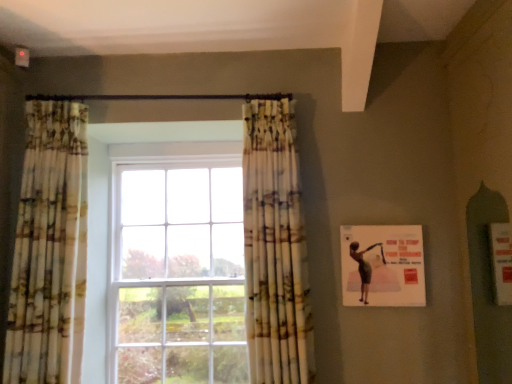
Where is `printed fabric curtain at center, the second curtain in the left-to-right sequence`? Image resolution: width=512 pixels, height=384 pixels. printed fabric curtain at center, the second curtain in the left-to-right sequence is located at coordinates (275, 248).

The width and height of the screenshot is (512, 384). What do you see at coordinates (50, 249) in the screenshot?
I see `printed fabric curtain at left, the 1th curtain positioned from the left` at bounding box center [50, 249].

Identify the location of printed fabric curtain at center, the second curtain in the left-to-right sequence. (275, 248).

Is printed fabric curtain at left, positioned as the second curtain in right-to-left order, situated inside matte pink poster at right or outside?

printed fabric curtain at left, positioned as the second curtain in right-to-left order, exists outside the volume of matte pink poster at right.

Can you confirm if printed fabric curtain at left, positioned as the second curtain in right-to-left order, is smaller than matte pink poster at right?

Actually, printed fabric curtain at left, positioned as the second curtain in right-to-left order, might be larger than matte pink poster at right.

Looking at this image, which object is positioned more to the left, printed fabric curtain at left, the 1th curtain positioned from the left, or matte pink poster at right?

Positioned to the left is printed fabric curtain at left, the 1th curtain positioned from the left.

Is the depth of printed fabric curtain at left, positioned as the second curtain in right-to-left order, less than that of matte pink poster at right?

Yes, printed fabric curtain at left, positioned as the second curtain in right-to-left order, is closer to the viewer.

From the image's perspective, which one is positioned higher, printed fabric curtain at center, which is the 1th curtain in right-to-left order, or printed fabric curtain at left, the 1th curtain positioned from the left?

printed fabric curtain at left, the 1th curtain positioned from the left, from the image's perspective.

Is printed fabric curtain at center, which is the 1th curtain in right-to-left order, beside printed fabric curtain at left, the 1th curtain positioned from the left?

No, printed fabric curtain at center, which is the 1th curtain in right-to-left order, is not with printed fabric curtain at left, the 1th curtain positioned from the left.

Is printed fabric curtain at center, which is the 1th curtain in right-to-left order, facing away from printed fabric curtain at left, the 1th curtain positioned from the left?

No, printed fabric curtain at left, the 1th curtain positioned from the left, is not at the back of printed fabric curtain at center, which is the 1th curtain in right-to-left order.

Can you confirm if printed fabric curtain at center, the second curtain in the left-to-right sequence, is bigger than printed fabric curtain at left, the 1th curtain positioned from the left?

Actually, printed fabric curtain at center, the second curtain in the left-to-right sequence, might be smaller than printed fabric curtain at left, the 1th curtain positioned from the left.

In terms of height, does matte pink poster at right look taller or shorter compared to printed fabric curtain at center, which is the 1th curtain in right-to-left order?

Considering their sizes, matte pink poster at right has less height than printed fabric curtain at center, which is the 1th curtain in right-to-left order.

From the image's perspective, is matte pink poster at right above printed fabric curtain at center, the second curtain in the left-to-right sequence?

Actually, matte pink poster at right appears below printed fabric curtain at center, the second curtain in the left-to-right sequence, in the image.

From a real-world perspective, who is located lower, matte pink poster at right or printed fabric curtain at center, which is the 1th curtain in right-to-left order?

matte pink poster at right, from a real-world perspective.

Could you measure the distance between matte pink poster at right and printed fabric curtain at left, the 1th curtain positioned from the left?

The distance of matte pink poster at right from printed fabric curtain at left, the 1th curtain positioned from the left, is 1.52 meters.

From a real-world perspective, is matte pink poster at right above or below printed fabric curtain at left, the 1th curtain positioned from the left?

In terms of real-world spatial position, matte pink poster at right is below printed fabric curtain at left, the 1th curtain positioned from the left.

Is matte pink poster at right taller or shorter than printed fabric curtain at left, the 1th curtain positioned from the left?

Clearly, matte pink poster at right is shorter compared to printed fabric curtain at left, the 1th curtain positioned from the left.

Looking at this image, which object is further away from the camera, printed fabric curtain at center, which is the 1th curtain in right-to-left order, or matte pink poster at right?

matte pink poster at right is further from the camera.

Is printed fabric curtain at center, the second curtain in the left-to-right sequence, taller or shorter than matte pink poster at right?

printed fabric curtain at center, the second curtain in the left-to-right sequence, is taller than matte pink poster at right.

How much distance is there between printed fabric curtain at center, which is the 1th curtain in right-to-left order, and matte pink poster at right?

printed fabric curtain at center, which is the 1th curtain in right-to-left order, is 16.39 inches away from matte pink poster at right.

Considering the relative sizes of printed fabric curtain at center, which is the 1th curtain in right-to-left order, and matte pink poster at right in the image provided, is printed fabric curtain at center, which is the 1th curtain in right-to-left order, wider than matte pink poster at right?

Yes, printed fabric curtain at center, which is the 1th curtain in right-to-left order, is wider than matte pink poster at right.

Is printed fabric curtain at center, the second curtain in the left-to-right sequence, at the back of printed fabric curtain at left, positioned as the second curtain in right-to-left order?

No, printed fabric curtain at center, the second curtain in the left-to-right sequence, is not at the back of printed fabric curtain at left, positioned as the second curtain in right-to-left order.

Is the surface of printed fabric curtain at left, positioned as the second curtain in right-to-left order, in direct contact with printed fabric curtain at center, the second curtain in the left-to-right sequence?

No, printed fabric curtain at left, positioned as the second curtain in right-to-left order, is not making contact with printed fabric curtain at center, the second curtain in the left-to-right sequence.

Is printed fabric curtain at left, positioned as the second curtain in right-to-left order, to the left or to the right of printed fabric curtain at center, which is the 1th curtain in right-to-left order, in the image?

printed fabric curtain at left, positioned as the second curtain in right-to-left order, is to the left of printed fabric curtain at center, which is the 1th curtain in right-to-left order.

From the image's perspective, is printed fabric curtain at left, the 1th curtain positioned from the left, positioned above or below printed fabric curtain at center, the second curtain in the left-to-right sequence?

Based on their image positions, printed fabric curtain at left, the 1th curtain positioned from the left, is located above printed fabric curtain at center, the second curtain in the left-to-right sequence.

The image size is (512, 384). I want to click on poster below the printed fabric curtain at left, positioned as the second curtain in right-to-left order (from the image's perspective), so click(x=383, y=265).

The image size is (512, 384). I want to click on curtain in front of the printed fabric curtain at left, the 1th curtain positioned from the left, so click(275, 248).

Looking at the image, which one is located further to printed fabric curtain at left, positioned as the second curtain in right-to-left order, printed fabric curtain at center, the second curtain in the left-to-right sequence, or matte pink poster at right?

The object further to printed fabric curtain at left, positioned as the second curtain in right-to-left order, is matte pink poster at right.

Looking at this image, based on their spatial positions, is matte pink poster at right or printed fabric curtain at center, which is the 1th curtain in right-to-left order, further from printed fabric curtain at left, the 1th curtain positioned from the left?

matte pink poster at right is further to printed fabric curtain at left, the 1th curtain positioned from the left.

From the picture: Considering their positions, is printed fabric curtain at left, the 1th curtain positioned from the left, positioned further to matte pink poster at right than printed fabric curtain at center, which is the 1th curtain in right-to-left order?

The object further to matte pink poster at right is printed fabric curtain at left, the 1th curtain positioned from the left.

Looking at the image, which one is located further to printed fabric curtain at center, the second curtain in the left-to-right sequence, matte pink poster at right or printed fabric curtain at left, positioned as the second curtain in right-to-left order?

printed fabric curtain at left, positioned as the second curtain in right-to-left order, lies further to printed fabric curtain at center, the second curtain in the left-to-right sequence, than the other object.

Considering their positions, is printed fabric curtain at left, positioned as the second curtain in right-to-left order, positioned closer to printed fabric curtain at center, which is the 1th curtain in right-to-left order, than matte pink poster at right?

The object closer to printed fabric curtain at center, which is the 1th curtain in right-to-left order, is matte pink poster at right.

Looking at the image, which one is located closer to matte pink poster at right, printed fabric curtain at center, which is the 1th curtain in right-to-left order, or printed fabric curtain at left, positioned as the second curtain in right-to-left order?

printed fabric curtain at center, which is the 1th curtain in right-to-left order, is positioned closer to the anchor matte pink poster at right.

Image resolution: width=512 pixels, height=384 pixels. What are the coordinates of `curtain between printed fabric curtain at left, the 1th curtain positioned from the left, and matte pink poster at right, in the horizontal direction` in the screenshot? It's located at [275, 248].